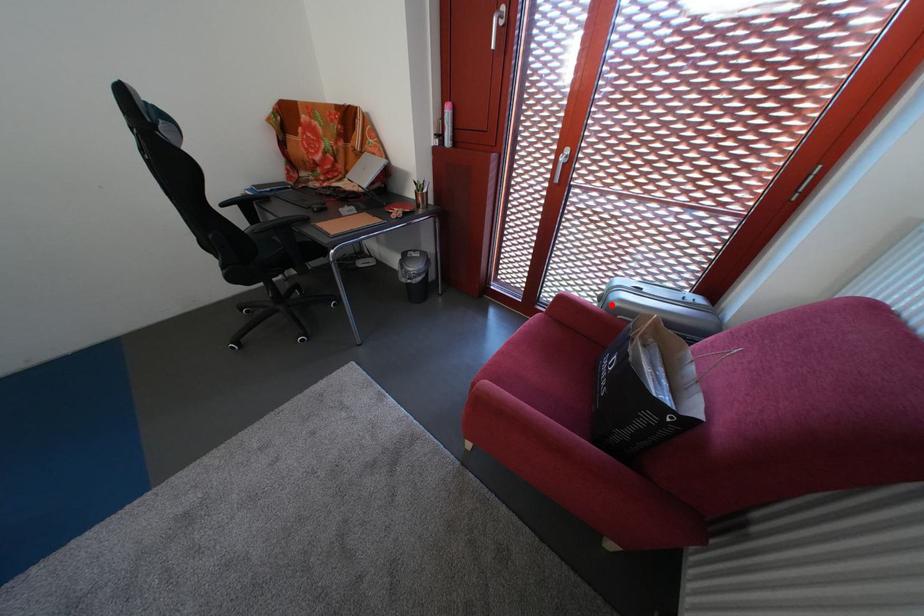
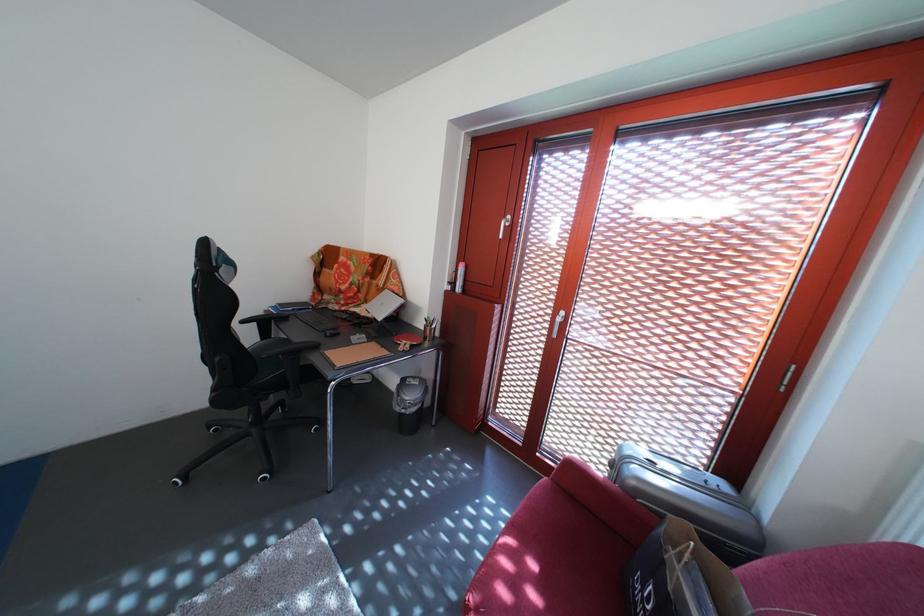
Question: I am providing you with two images of the same scene from different viewpoints. In image1, a red point is highlighted. Considering the same 3D point in image2, which of the following is correct?

Choices:
 (A) It is closer
 (B) It is farther

Answer: (B)